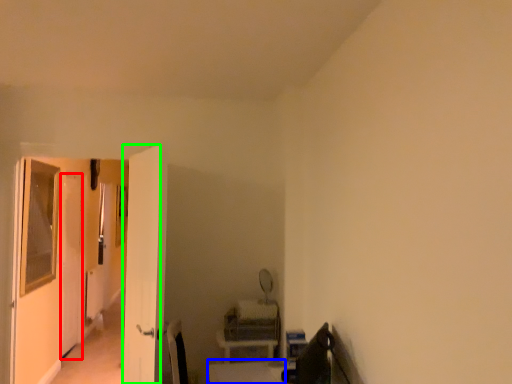
Question: Based on their relative distances, which object is farther from screen door (highlighted by a red box)? Choose from table (highlighted by a blue box) and screen door (highlighted by a green box).

Choices:
 (A) table
 (B) screen door

Answer: (A)